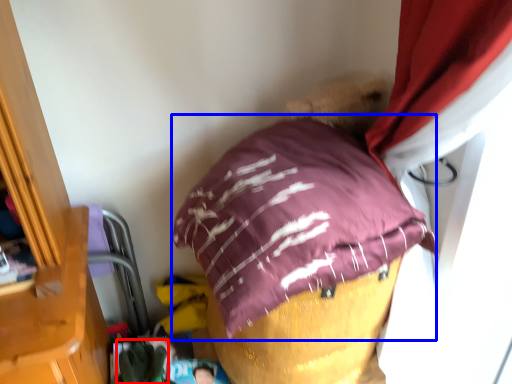
Question: Which object appears closest to the camera in this image, clothing (highlighted by a red box) or pillow (highlighted by a blue box)?

Choices:
 (A) clothing
 (B) pillow

Answer: (B)